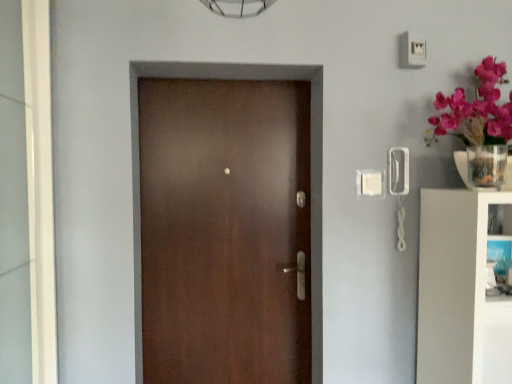
Where is `free space above satin brown door at center (from a real-world perspective)`? This screenshot has width=512, height=384. free space above satin brown door at center (from a real-world perspective) is located at coordinates (230, 76).